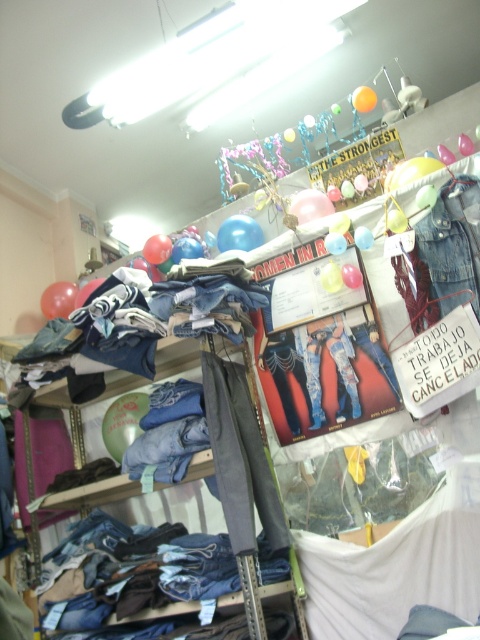
Question: Estimate the real-world distances between objects in this image. Which object is closer to the denim jeans at lower left?

Choices:
 (A) denim jacket at upper right
 (B) orange matte balloon at upper center
 (C) denim jeans at center
 (D) rubberized glossy balloon at upper center

Answer: (C)

Question: Does yellow paper balloon at upper center have a smaller size compared to orange matte balloon at upper center?

Choices:
 (A) yes
 (B) no

Answer: (A)

Question: Which of the following is the farthest from the observer?

Choices:
 (A) orange matte balloon at upper center
 (B) yellow paper balloon at upper center

Answer: (A)

Question: Which of the following is the closest to the observer?

Choices:
 (A) (328, 275)
 (B) (78, 531)
 (C) (222, 250)

Answer: (A)

Question: Does translucent blue balloon at upper center have a larger size compared to rubberized glossy balloon at upper center?

Choices:
 (A) yes
 (B) no

Answer: (B)

Question: Is denim jacket at upper right thinner than rubberized glossy balloon at upper center?

Choices:
 (A) yes
 (B) no

Answer: (A)